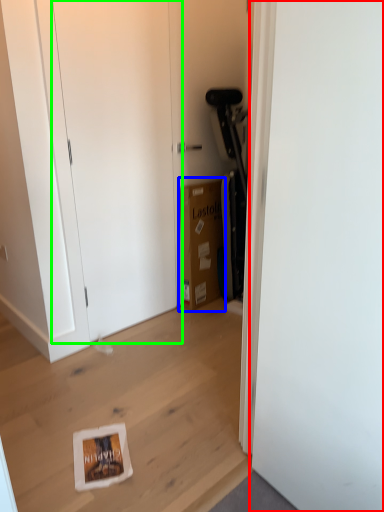
Question: Which is nearer to the door (highlighted by a red box)? cardboard box (highlighted by a blue box) or door (highlighted by a green box).

Choices:
 (A) cardboard box
 (B) door

Answer: (B)